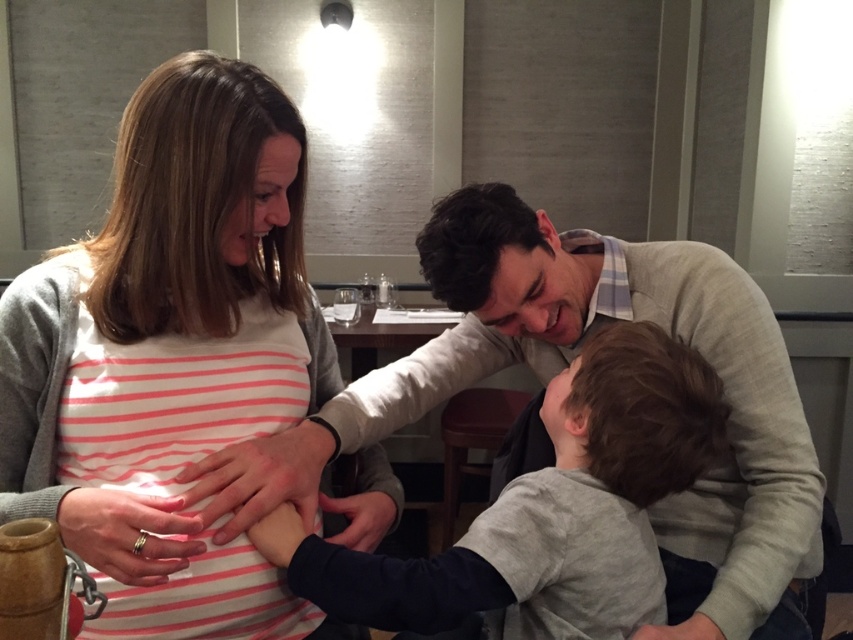
You are a photographer taking a photo of the scene. You notice the pink striped shirt at center and the gray cotton shirt at center. Which one is positioned higher in the image?

The pink striped shirt at center is located above the gray cotton shirt at center, so it is positioned higher in the image.

You are a photographer taking a portrait of the gray cotton shirt at center and the matte black hand at center. Which object should you focus on first if you want to capture both in one shot without cropping?

The gray cotton shirt at center has a larger size compared to matte black hand at center, so you should focus on the gray cotton shirt at center first to ensure it is in clear view before adjusting for the smaller matte black hand at center.